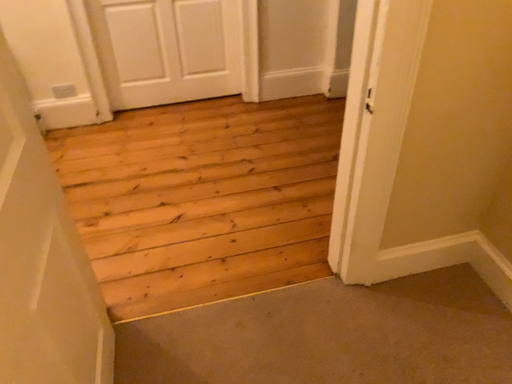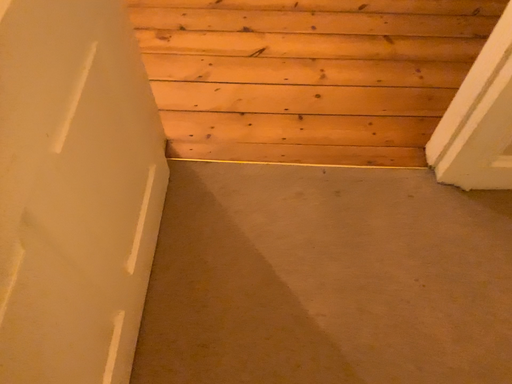
Question: How did the camera likely rotate when shooting the video?

Choices:
 (A) rotated upward
 (B) rotated downward

Answer: (B)